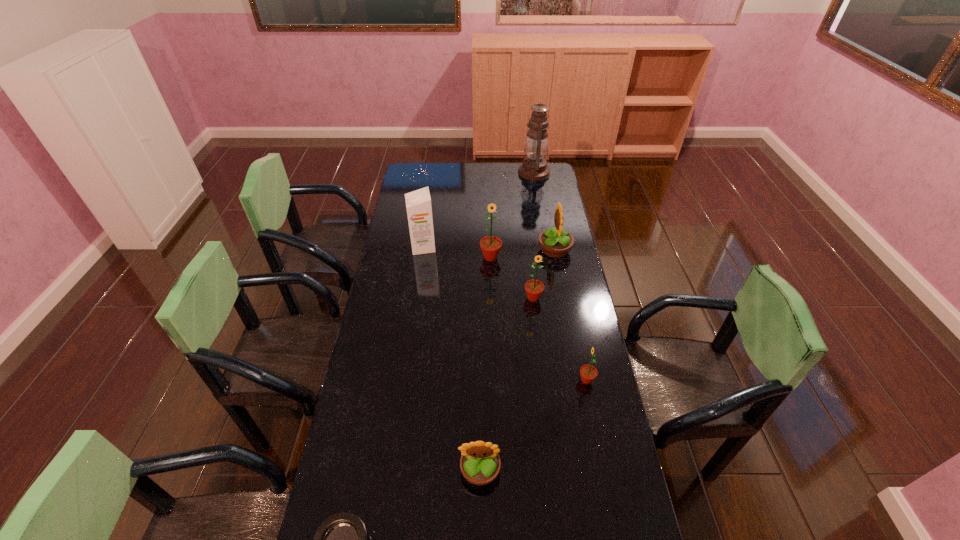
The width and height of the screenshot is (960, 540). I want to click on vacant space located on the face of the left yellow sunflower, so coord(480,529).

Where is `vacant space located 0.150m on the face of the sixth farthest object`? The width and height of the screenshot is (960, 540). vacant space located 0.150m on the face of the sixth farthest object is located at coordinates (535, 380).

In order to click on vacant point located 0.230m on the face of the sixth farthest object in this screenshot , I will do click(x=512, y=380).

Where is `vacant space located on the face of the sixth farthest object`? Image resolution: width=960 pixels, height=540 pixels. vacant space located on the face of the sixth farthest object is located at coordinates (561, 380).

Locate an element on the screen. object located in the far edge section of the desktop is located at coordinates tap(534, 167).

You are a GUI agent. You are given a task and a screenshot of the screen. Output one action in this format:
    pyautogui.click(x=<x>, y=<y>)
    Task: Click on the object located at the left edge
    
    Given the screenshot: What is the action you would take?
    pyautogui.click(x=418, y=203)

I want to click on oil lamp located in the right edge section of the desktop, so click(x=534, y=167).

The width and height of the screenshot is (960, 540). In order to click on object that is at the far right corner in this screenshot , I will do `click(534, 167)`.

I want to click on free spot at the far edge of the desktop, so click(x=503, y=163).

Find the location of a particular element. The width and height of the screenshot is (960, 540). free region at the left edge of the desktop is located at coordinates (396, 382).